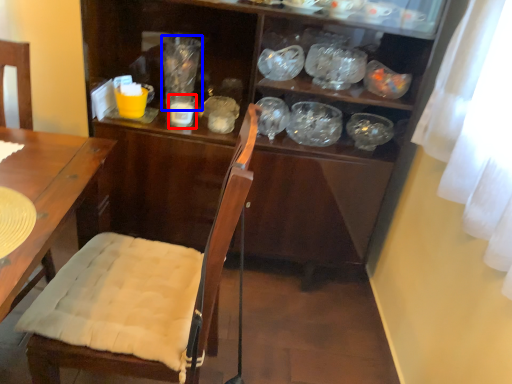
Question: Which object appears farthest to the camera in this image, tableware (highlighted by a red box) or glass jar (highlighted by a blue box)?

Choices:
 (A) tableware
 (B) glass jar

Answer: (B)